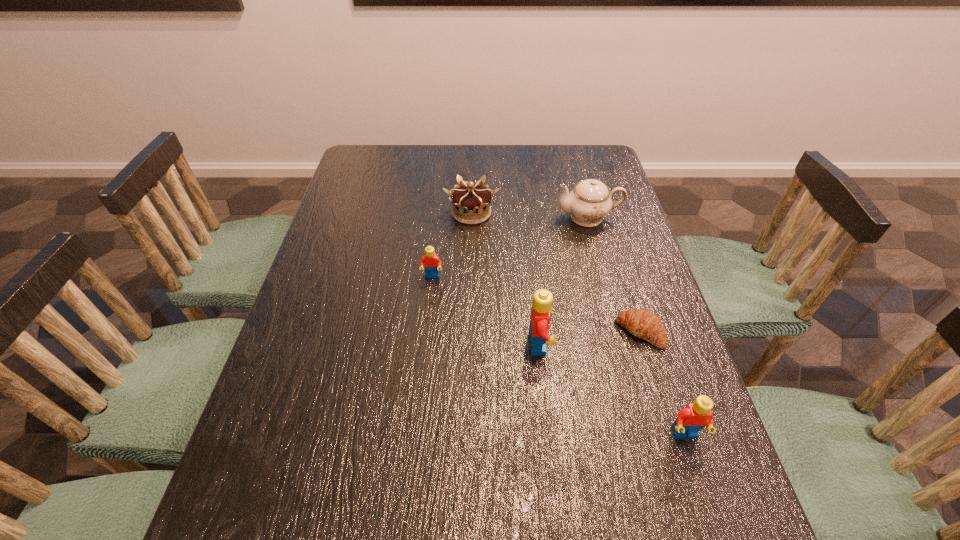
The height and width of the screenshot is (540, 960). I want to click on free area in between the chinaware and the second farthest Lego, so click(x=564, y=281).

Find the location of a particular element. The height and width of the screenshot is (540, 960). free space that is in between the crown and the shortest object is located at coordinates (556, 273).

The height and width of the screenshot is (540, 960). What are the coordinates of `free space between the shortest object and the crown` in the screenshot? It's located at (556, 273).

Where is `unoccupied area between the chinaware and the shortest object`? unoccupied area between the chinaware and the shortest object is located at coordinates (614, 275).

Find the location of a particular element. free space between the leftmost Lego and the chinaware is located at coordinates (510, 247).

In order to click on the second closest object to the shortest Lego in this screenshot , I will do 542,302.

Locate an element on the screen. The width and height of the screenshot is (960, 540). the third closest object to the chinaware is located at coordinates (542, 302).

Locate which Lego ranks third in proximity to the chinaware. Please provide its 2D coordinates. Your answer should be formatted as a tuple, i.e. [(x, y)], where the tuple contains the x and y coordinates of a point satisfying the conditions above.

[(693, 417)]

Locate which Lego ranks second in proximity to the crown. Please provide its 2D coordinates. Your answer should be formatted as a tuple, i.e. [(x, y)], where the tuple contains the x and y coordinates of a point satisfying the conditions above.

[(542, 302)]